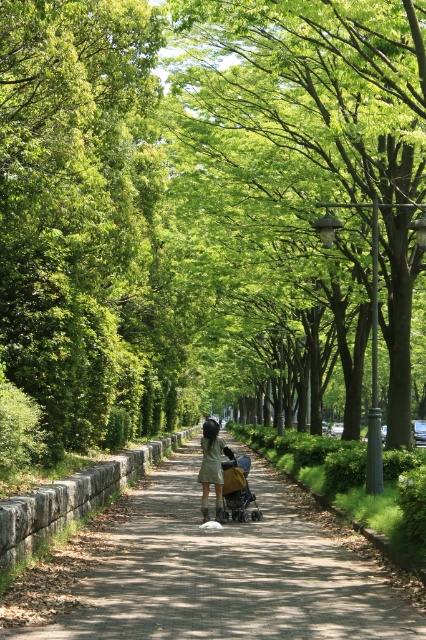
Question: Does brown gravel path at center lie behind matte gray dress at center?

Choices:
 (A) yes
 (B) no

Answer: (B)

Question: Is brown gravel path at center closer to the viewer compared to brown fabric baby carriage at center?

Choices:
 (A) no
 (B) yes

Answer: (B)

Question: Which point is closer to the camera?

Choices:
 (A) (149, 618)
 (B) (386, 212)
 (C) (210, 461)

Answer: (A)

Question: Does brown gravel path at center appear on the right side of matte gray dress at center?

Choices:
 (A) no
 (B) yes

Answer: (B)

Question: Which point appears closest to the camera in this image?

Choices:
 (A) (244, 516)
 (B) (218, 481)

Answer: (B)

Question: Based on their relative distances, which object is farther from the brown gravel path at center?

Choices:
 (A) brown fabric baby carriage at center
 (B) matte gray dress at center
 (C) green leafy tree at center

Answer: (C)